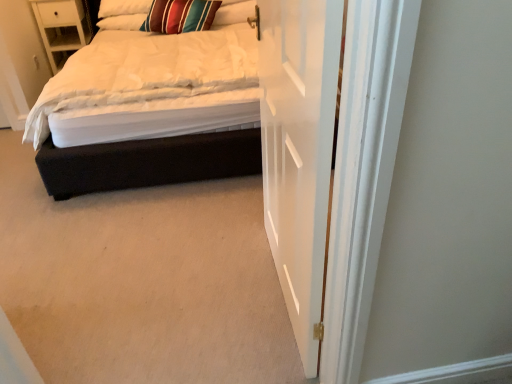
This screenshot has height=384, width=512. What do you see at coordinates (62, 28) in the screenshot? I see `white wood nightstand at upper left` at bounding box center [62, 28].

What do you see at coordinates (122, 22) in the screenshot? Image resolution: width=512 pixels, height=384 pixels. I see `white soft pillow at upper left, acting as the second pillow starting from the right` at bounding box center [122, 22].

Describe the element at coordinates (180, 16) in the screenshot. I see `striped fabric pillow at upper center, the 2th pillow from the left` at that location.

Identify the location of white wood nightstand at upper left. Image resolution: width=512 pixels, height=384 pixels. (62, 28).

Consider the image. How different are the orientations of striped fabric pillow at upper center, which ranks as the 1th pillow in right-to-left order, and velvet black bed at center in degrees?

10.7 degrees separate the facing orientations of striped fabric pillow at upper center, which ranks as the 1th pillow in right-to-left order, and velvet black bed at center.

Is point (176, 15) farther from camera compared to point (78, 102)?

Yes, point (176, 15) is behind point (78, 102).

Looking at this image, considering the relative positions of striped fabric pillow at upper center, the 2th pillow from the left, and velvet black bed at center in the image provided, is striped fabric pillow at upper center, the 2th pillow from the left, to the right of velvet black bed at center from the viewer's perspective?

Correct, you'll find striped fabric pillow at upper center, the 2th pillow from the left, to the right of velvet black bed at center.

Who is more distant, striped fabric pillow at upper center, which ranks as the 1th pillow in right-to-left order, or velvet black bed at center?

Positioned behind is striped fabric pillow at upper center, which ranks as the 1th pillow in right-to-left order.

Can you tell me how much white wood nightstand at upper left and striped fabric pillow at upper center, the 2th pillow from the left, differ in facing direction?

They differ by 10.5 degrees in their facing directions.

Could you tell me if white wood nightstand at upper left is facing striped fabric pillow at upper center, the 2th pillow from the left?

No.

Is the position of white wood nightstand at upper left more distant than that of striped fabric pillow at upper center, which ranks as the 1th pillow in right-to-left order?

Yes, white wood nightstand at upper left is behind striped fabric pillow at upper center, which ranks as the 1th pillow in right-to-left order.

Measure the distance between white wood nightstand at upper left and striped fabric pillow at upper center, the 2th pillow from the left.

white wood nightstand at upper left and striped fabric pillow at upper center, the 2th pillow from the left, are 97.90 centimeters apart.

Is white soft pillow at upper left, placed as the 1th pillow when sorted from left to right, not close to white wooden door at center?

Yes, white soft pillow at upper left, placed as the 1th pillow when sorted from left to right, and white wooden door at center are located far from each other.

Considering the positions of objects white soft pillow at upper left, acting as the second pillow starting from the right, and white wooden door at center in the image provided, who is more to the right, white soft pillow at upper left, acting as the second pillow starting from the right, or white wooden door at center?

Positioned to the right is white wooden door at center.

Does white soft pillow at upper left, placed as the 1th pillow when sorted from left to right, turn towards white wooden door at center?

Yes, white soft pillow at upper left, placed as the 1th pillow when sorted from left to right, is turned towards white wooden door at center.

Is point (136, 15) closer to camera compared to point (330, 161)?

No, it is behind (330, 161).

Is white wood nightstand at upper left facing away from velvet black bed at center?

No, white wood nightstand at upper left is not facing the opposite direction of velvet black bed at center.

In terms of width, does white wood nightstand at upper left look wider or thinner when compared to velvet black bed at center?

In the image, white wood nightstand at upper left appears to be more narrow than velvet black bed at center.

Are white wood nightstand at upper left and velvet black bed at center making contact?

white wood nightstand at upper left is not next to velvet black bed at center, and they're not touching.

Which object is positioned more to the left, striped fabric pillow at upper center, which ranks as the 1th pillow in right-to-left order, or white wood nightstand at upper left?

white wood nightstand at upper left.

Does striped fabric pillow at upper center, which ranks as the 1th pillow in right-to-left order, lie behind white wood nightstand at upper left?

No, it is not.

From the image's perspective, which is above, striped fabric pillow at upper center, the 2th pillow from the left, or white wood nightstand at upper left?

white wood nightstand at upper left is shown above in the image.

Can you confirm if striped fabric pillow at upper center, the 2th pillow from the left, is taller than white wood nightstand at upper left?

Incorrect, the height of striped fabric pillow at upper center, the 2th pillow from the left, is not larger of that of white wood nightstand at upper left.

Which is less distant, (81,138) or (66,55)?

A: Point (81,138) is closer to the camera than point (66,55).

Do you think velvet black bed at center is within white wood nightstand at upper left, or outside of it?

The correct answer is: outside.

Is velvet black bed at center facing away from white wood nightstand at upper left?

No.

Would you say velvet black bed at center is to the left or to the right of white soft pillow at upper left, placed as the 1th pillow when sorted from left to right, in the picture?

Clearly, velvet black bed at center is on the right of white soft pillow at upper left, placed as the 1th pillow when sorted from left to right, in the image.

Considering the positions of point (63, 180) and point (139, 20), is point (63, 180) closer or farther from the camera than point (139, 20)?

Point (63, 180).

How different are the orientations of velvet black bed at center and white soft pillow at upper left, acting as the second pillow starting from the right, in degrees?

velvet black bed at center and white soft pillow at upper left, acting as the second pillow starting from the right, are facing 7.58 degrees away from each other.

Would you say white soft pillow at upper left, acting as the second pillow starting from the right, is part of velvet black bed at center's contents?

Yes, white soft pillow at upper left, acting as the second pillow starting from the right, is inside velvet black bed at center.

From the velvet black bed at center, count 1st pillows backward and point to it. Please provide its 2D coordinates.

[(180, 16)]

The width and height of the screenshot is (512, 384). Find the location of `pillow that is the 2nd object to the right of the white wood nightstand at upper left, starting at the anchor`. pillow that is the 2nd object to the right of the white wood nightstand at upper left, starting at the anchor is located at coordinates coord(180,16).

When comparing their distances from striped fabric pillow at upper center, which ranks as the 1th pillow in right-to-left order, does velvet black bed at center or white wood nightstand at upper left seem further?

velvet black bed at center.

When comparing their distances from white wood nightstand at upper left, does white soft pillow at upper left, placed as the 1th pillow when sorted from left to right, or striped fabric pillow at upper center, the 2th pillow from the left, seem closer?

The object closer to white wood nightstand at upper left is white soft pillow at upper left, placed as the 1th pillow when sorted from left to right.

Based on their spatial positions, is striped fabric pillow at upper center, which ranks as the 1th pillow in right-to-left order, or white wood nightstand at upper left further from white soft pillow at upper left, acting as the second pillow starting from the right?

The object further to white soft pillow at upper left, acting as the second pillow starting from the right, is white wood nightstand at upper left.

Estimate the real-world distances between objects in this image. Which object is closer to white wooden door at center, white wood nightstand at upper left or striped fabric pillow at upper center, the 2th pillow from the left?

striped fabric pillow at upper center, the 2th pillow from the left.

From the image, which object appears to be nearer to velvet black bed at center, white wooden door at center or striped fabric pillow at upper center, which ranks as the 1th pillow in right-to-left order?

Based on the image, white wooden door at center appears to be nearer to velvet black bed at center.

Estimate the real-world distances between objects in this image. Which object is further from white wood nightstand at upper left, white soft pillow at upper left, acting as the second pillow starting from the right, or white wooden door at center?

Among the two, white wooden door at center is located further to white wood nightstand at upper left.

Based on their spatial positions, is white wood nightstand at upper left or velvet black bed at center closer to white soft pillow at upper left, placed as the 1th pillow when sorted from left to right?

white wood nightstand at upper left lies closer to white soft pillow at upper left, placed as the 1th pillow when sorted from left to right, than the other object.

Estimate the real-world distances between objects in this image. Which object is further from white soft pillow at upper left, acting as the second pillow starting from the right, velvet black bed at center or white wood nightstand at upper left?

velvet black bed at center.

You are a GUI agent. You are given a task and a screenshot of the screen. Output one action in this format:
    pyautogui.click(x=<x>, y=<y>)
    Task: Click on the pillow between velvet black bed at center and white wood nightstand at upper left in the front-back direction
    This screenshot has width=512, height=384.
    Given the screenshot: What is the action you would take?
    pyautogui.click(x=180, y=16)

Where is `pillow positioned between velvet black bed at center and white soft pillow at upper left, acting as the second pillow starting from the right, from near to far`? The width and height of the screenshot is (512, 384). pillow positioned between velvet black bed at center and white soft pillow at upper left, acting as the second pillow starting from the right, from near to far is located at coordinates (180, 16).

The width and height of the screenshot is (512, 384). What are the coordinates of `nightstand located between white wooden door at center and white soft pillow at upper left, placed as the 1th pillow when sorted from left to right, in the depth direction` in the screenshot? It's located at (62, 28).

Locate an element on the screen. The width and height of the screenshot is (512, 384). bed between white wooden door at center and striped fabric pillow at upper center, the 2th pillow from the left, from front to back is located at coordinates (152, 109).